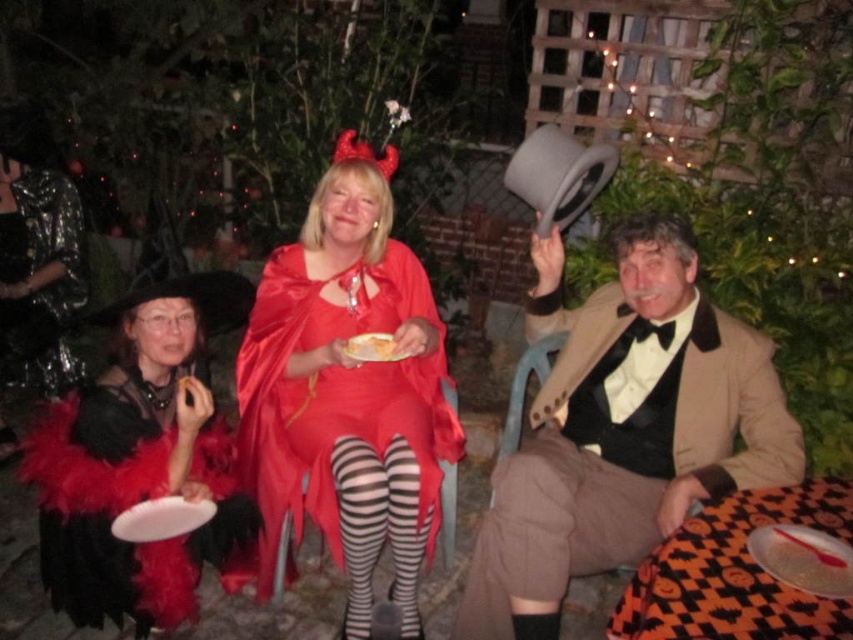
Question: Among these points, which one is nearest to the camera?

Choices:
 (A) (241, 388)
 (B) (381, 340)
 (C) (155, 529)

Answer: (C)

Question: Which point is closer to the camera?

Choices:
 (A) (453, 627)
 (B) (386, 228)
 (C) (28, 362)

Answer: (A)

Question: Observing the image, what is the correct spatial positioning of black feather boa at left in reference to matte silver platter at lower right?

Choices:
 (A) below
 (B) above

Answer: (B)

Question: Can you confirm if brown wool suit at right is bigger than matte silver platter at lower right?

Choices:
 (A) yes
 (B) no

Answer: (A)

Question: Is brown wool suit at right bigger than shiny black cape at left?

Choices:
 (A) yes
 (B) no

Answer: (A)

Question: Which point appears closest to the camera in this image?

Choices:
 (A) click(x=831, y=570)
 (B) click(x=328, y=515)

Answer: (A)